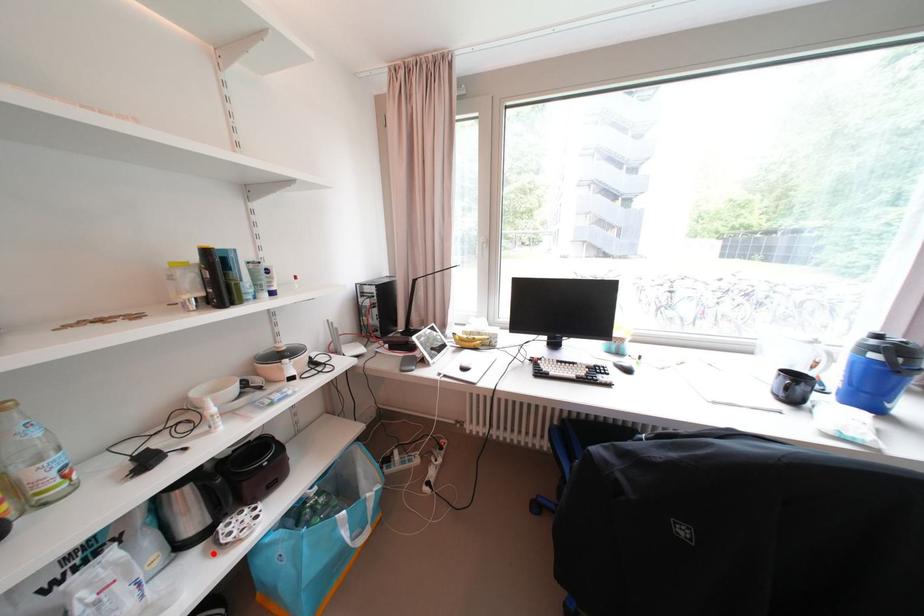
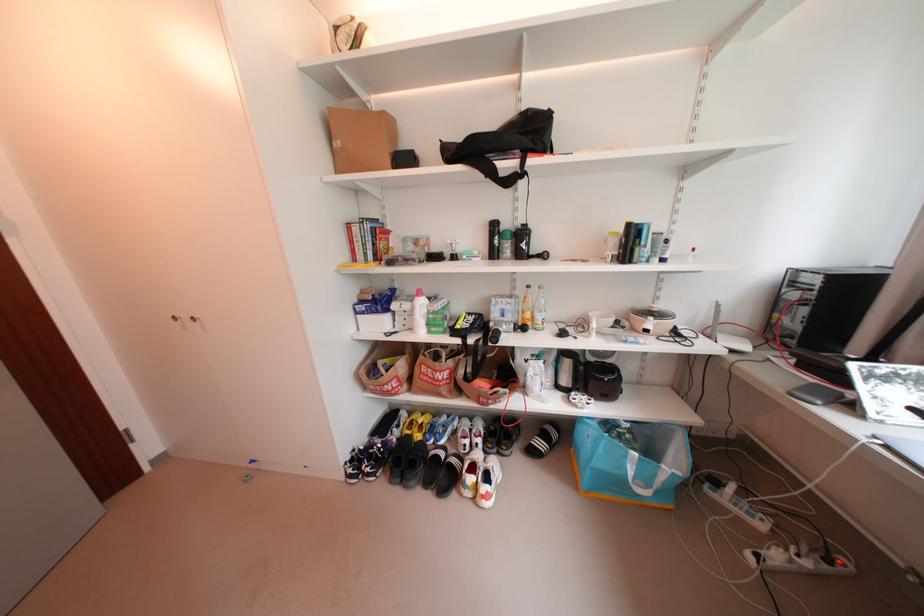
Question: I am providing you with two images of the same scene from different viewpoints. Image1 has a red point marked. In image2, the corresponding 3D location appears at what relative position? Reply with the corresponding letter.

Choices:
 (A) Closer
 (B) Farther

Answer: (B)